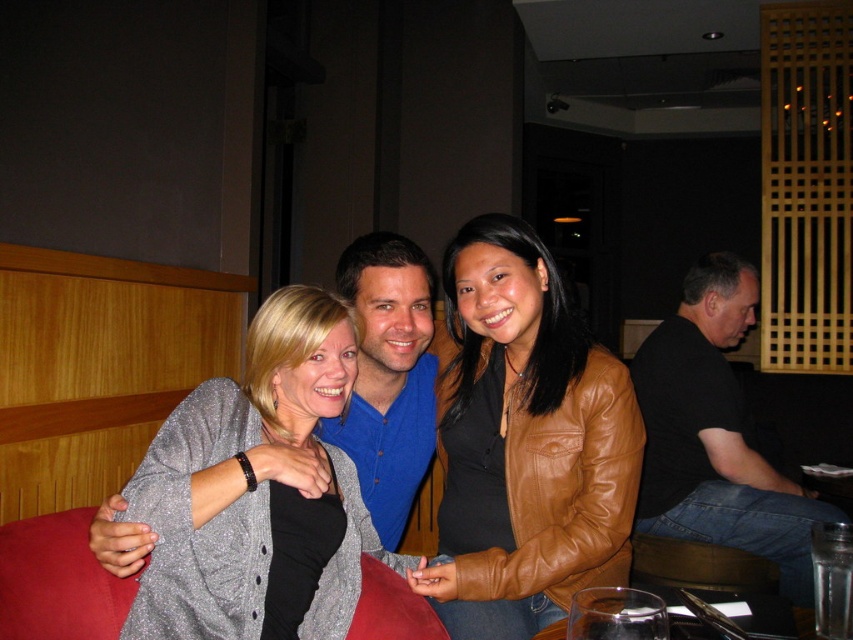
In the scene, there are two people wearing the brown leather jacket at center and the black cotton shirt at right. Which clothing item is positioned higher in the image?

The brown leather jacket at center is positioned higher than the black cotton shirt at right.

You are a photographer trying to capture a group photo of the three people in the scene. The camera you are using has a maximum width of 1 meter. The brown leather jacket at center and transparent glass at lower center are in the frame. Which object will fit better within the camera frame?

The brown leather jacket at center has a width less than the transparent glass at lower center, so it will fit better within the camera frame.

You are a photographer setting up a photo shoot. You have two subjects wearing the sparkly gray cardigan at center and the black cotton shirt at right. You need to position them so that they are exactly 1.2 meters apart for the shot. Based on their current positions, will you need to move them closer together or farther apart?

The sparkly gray cardigan at center is currently 1.17 meters from the black cotton shirt at right. Since 1.17 meters is less than the required 1.2 meters, you will need to move them slightly farther apart to achieve the desired distance.